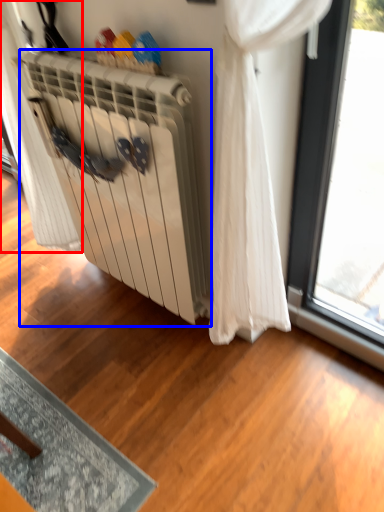
Question: Which object appears farthest to the camera in this image, curtain (highlighted by a red box) or radiator (highlighted by a blue box)?

Choices:
 (A) curtain
 (B) radiator

Answer: (A)